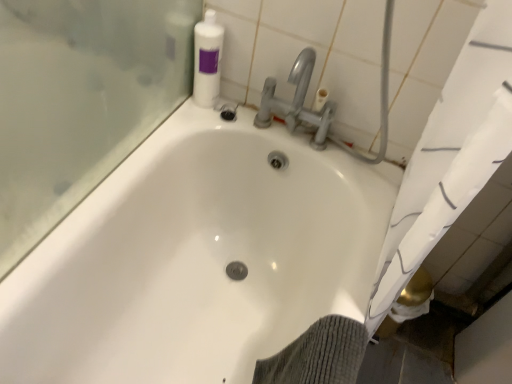
Identify the location of vacant area that is in front of white plastic bottle at upper right. (188, 116).